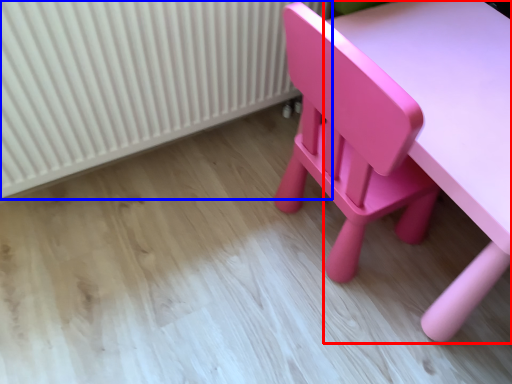
Question: Which object appears farthest to the camera in this image, table (highlighted by a red box) or radiator (highlighted by a blue box)?

Choices:
 (A) table
 (B) radiator

Answer: (B)